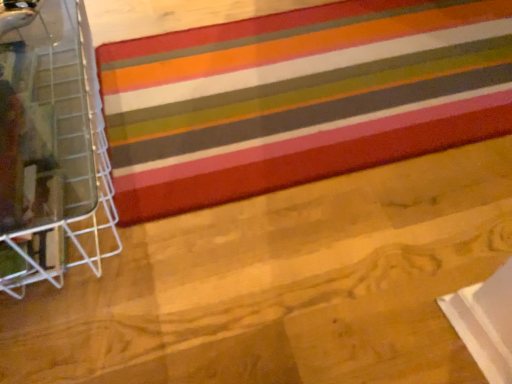
You are a GUI agent. You are given a task and a screenshot of the screen. Output one action in this format:
    pyautogui.click(x=<x>, y=<y>)
    Task: Click on the multicolored striped rug at center
    This screenshot has height=384, width=512.
    Given the screenshot: What is the action you would take?
    pyautogui.click(x=293, y=94)

What do you see at coordinates (293, 94) in the screenshot? The image size is (512, 384). I see `multicolored striped rug at center` at bounding box center [293, 94].

This screenshot has height=384, width=512. What do you see at coordinates (50, 144) in the screenshot?
I see `clear plastic basket at left` at bounding box center [50, 144].

Identify the location of clear plastic basket at left. The image size is (512, 384). (50, 144).

You are a GUI agent. You are given a task and a screenshot of the screen. Output one action in this format:
    pyautogui.click(x=<x>, y=<y>)
    Task: Click on the multicolored striped rug at center
    The width and height of the screenshot is (512, 384).
    Given the screenshot: What is the action you would take?
    pyautogui.click(x=293, y=94)

Which object is positioned more to the right, multicolored striped rug at center or clear plastic basket at left?

Positioned to the right is multicolored striped rug at center.

In the scene shown: Does multicolored striped rug at center come in front of clear plastic basket at left?

No, it is behind clear plastic basket at left.

Considering the positions of points (333, 129) and (64, 227), is point (333, 129) closer to camera compared to point (64, 227)?

No, it is not.

From the image's perspective, is multicolored striped rug at center under clear plastic basket at left?

No, from the image's perspective, multicolored striped rug at center is not below clear plastic basket at left.

From a real-world perspective, is multicolored striped rug at center above or below clear plastic basket at left?

In terms of real-world spatial position, multicolored striped rug at center is below clear plastic basket at left.

Can you confirm if multicolored striped rug at center is wider than clear plastic basket at left?

Correct, the width of multicolored striped rug at center exceeds that of clear plastic basket at left.

Does multicolored striped rug at center have a lesser height compared to clear plastic basket at left?

Correct, multicolored striped rug at center is not as tall as clear plastic basket at left.

Looking at this image, considering the sizes of multicolored striped rug at center and clear plastic basket at left in the image, is multicolored striped rug at center bigger or smaller than clear plastic basket at left?

In the image, multicolored striped rug at center appears to be smaller than clear plastic basket at left.

Is multicolored striped rug at center surrounding clear plastic basket at left?

Actually, clear plastic basket at left is outside multicolored striped rug at center.

Is multicolored striped rug at center not close to clear plastic basket at left?

No, multicolored striped rug at center is in close proximity to clear plastic basket at left.

Is multicolored striped rug at center facing away from clear plastic basket at left?

Yes, clear plastic basket at left is at the back of multicolored striped rug at center.

Find the location of `furniture located in front of the multicolored striped rug at center`. furniture located in front of the multicolored striped rug at center is located at coordinates pyautogui.click(x=50, y=144).

Between clear plastic basket at left and multicolored striped rug at center, which one appears on the right side from the viewer's perspective?

multicolored striped rug at center.

Is clear plastic basket at left positioned behind multicolored striped rug at center?

No, clear plastic basket at left is closer to the camera.

Is point (27, 134) closer to camera compared to point (341, 160)?

Yes, it is.

From the image's perspective, does clear plastic basket at left appear higher than multicolored striped rug at center?

No.

From a real-world perspective, between clear plastic basket at left and multicolored striped rug at center, who is vertically lower?

multicolored striped rug at center.

Between clear plastic basket at left and multicolored striped rug at center, which one has larger width?

Wider between the two is multicolored striped rug at center.

Which of these two, clear plastic basket at left or multicolored striped rug at center, stands taller?

clear plastic basket at left is taller.

Is clear plastic basket at left bigger or smaller than multicolored striped rug at center?

Clearly, clear plastic basket at left is larger in size than multicolored striped rug at center.

Is multicolored striped rug at center inside clear plastic basket at left?

Actually, multicolored striped rug at center is outside clear plastic basket at left.

Is clear plastic basket at left next to multicolored striped rug at center and touching it?

No, clear plastic basket at left is not touching multicolored striped rug at center.

Consider the image. Is clear plastic basket at left facing away from multicolored striped rug at center?

No, clear plastic basket at left is not facing the opposite direction of multicolored striped rug at center.

How many degrees apart are the facing directions of clear plastic basket at left and multicolored striped rug at center?

0.198 degrees.

Image resolution: width=512 pixels, height=384 pixels. I want to click on furniture above the multicolored striped rug at center (from a real-world perspective), so click(50, 144).

In order to click on quilt located on the right of clear plastic basket at left in this screenshot , I will do `click(293, 94)`.

Locate an element on the screen. This screenshot has height=384, width=512. furniture on the left of multicolored striped rug at center is located at coordinates (50, 144).